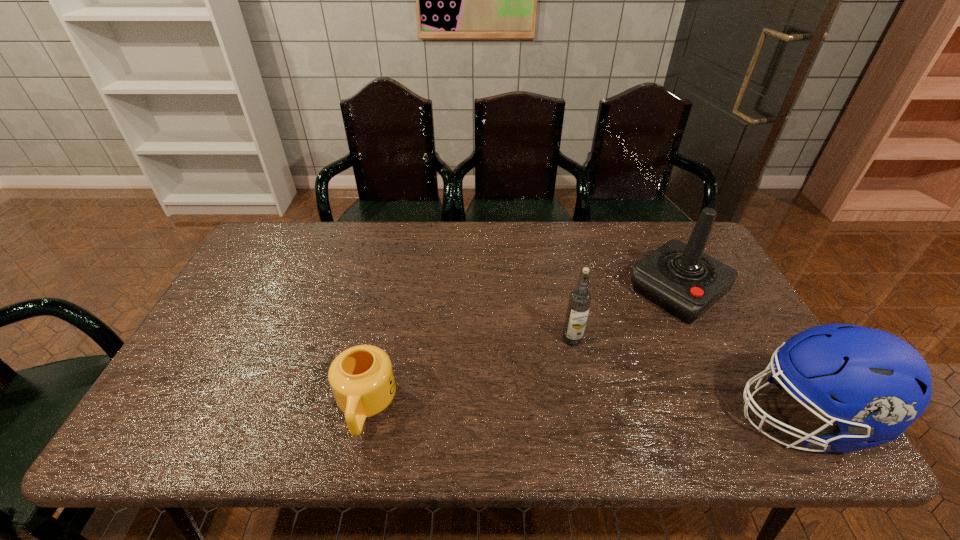
Locate an element on the screen. vacant region between the farthest object and the mug is located at coordinates (521, 349).

Where is `vacant space in between the football helmet and the second farthest object`? The image size is (960, 540). vacant space in between the football helmet and the second farthest object is located at coordinates (687, 379).

Where is `vacant area that lies between the shortest object and the joystick`? This screenshot has width=960, height=540. vacant area that lies between the shortest object and the joystick is located at coordinates (521, 349).

Where is `object that is the second closest to the vodka`? The width and height of the screenshot is (960, 540). object that is the second closest to the vodka is located at coordinates (882, 384).

The width and height of the screenshot is (960, 540). Identify the location of object that is the nearest to the farthest object. (882, 384).

Where is `vacant position in the image that satisfies the following two spatial constraints: 1. on the front side of the second farthest object; 2. on the front-facing side of the football helmet`? The image size is (960, 540). vacant position in the image that satisfies the following two spatial constraints: 1. on the front side of the second farthest object; 2. on the front-facing side of the football helmet is located at coordinates (588, 418).

Locate an element on the screen. Image resolution: width=960 pixels, height=540 pixels. vacant point that satisfies the following two spatial constraints: 1. on the handle side of the mug; 2. on the front-facing side of the football helmet is located at coordinates (364, 418).

Identify the location of free spot that satisfies the following two spatial constraints: 1. on the handle side of the football helmet; 2. on the front-facing side of the shortest object. (364, 418).

At what (x,y) coordinates should I click in order to perform the action: click on free region that satisfies the following two spatial constraints: 1. on the handle side of the football helmet; 2. on the front-facing side of the mug. Please return your answer as a coordinate pair (x, y). Looking at the image, I should click on (364, 418).

Find the location of `blank space that satisfies the following two spatial constraints: 1. on the handle side of the football helmet; 2. on the front-facing side of the leftmost object`. blank space that satisfies the following two spatial constraints: 1. on the handle side of the football helmet; 2. on the front-facing side of the leftmost object is located at coordinates (364, 418).